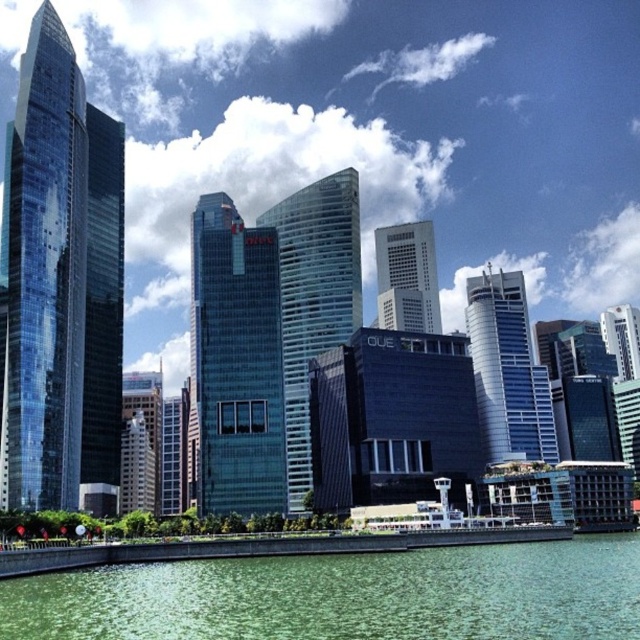
Is shiny glass skyscraper at left smaller than glassy blue skyscraper at center?

Yes.

Based on the photo, is shiny glass skyscraper at left shorter than glassy blue skyscraper at center?

Incorrect, shiny glass skyscraper at left's height does not fall short of glassy blue skyscraper at center's.

The image size is (640, 640). What do you see at coordinates (44, 273) in the screenshot? I see `shiny glass skyscraper at left` at bounding box center [44, 273].

The width and height of the screenshot is (640, 640). Identify the location of shiny glass skyscraper at left. (44, 273).

Is glassy blue skyscraper at center to the left of glassy reflective skyscraper at center from the viewer's perspective?

Correct, you'll find glassy blue skyscraper at center to the left of glassy reflective skyscraper at center.

Can you confirm if glassy blue skyscraper at center is positioned below glassy reflective skyscraper at center?

Indeed, glassy blue skyscraper at center is positioned under glassy reflective skyscraper at center.

Measure the distance between glassy blue skyscraper at center and camera.

glassy blue skyscraper at center is 357.54 feet from camera.

Identify the location of glassy blue skyscraper at center. (236, 362).

Is glassy blue skyscraper at center positioned before sleek glass skyscraper at center?

Yes, glassy blue skyscraper at center is in front of sleek glass skyscraper at center.

Can you confirm if glassy blue skyscraper at center is positioned to the left of sleek glass skyscraper at center?

Indeed, glassy blue skyscraper at center is positioned on the left side of sleek glass skyscraper at center.

The height and width of the screenshot is (640, 640). In order to click on glassy blue skyscraper at center in this screenshot , I will do `click(236, 362)`.